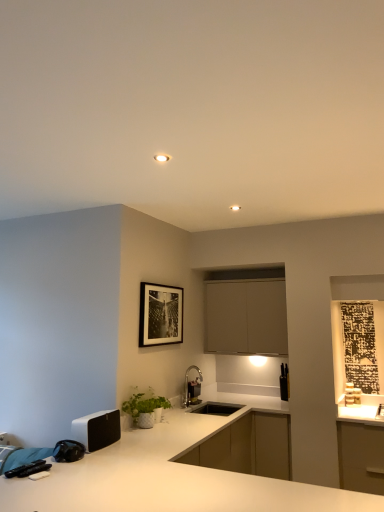
Question: From the image's perspective, is brushed metal faucet at lower center under white ceramic plant at lower center?

Choices:
 (A) no
 (B) yes

Answer: (B)

Question: From a real-world perspective, is brushed metal faucet at lower center under white ceramic plant at lower center?

Choices:
 (A) yes
 (B) no

Answer: (B)

Question: From the image's perspective, is brushed metal faucet at lower center over white ceramic plant at lower center?

Choices:
 (A) no
 (B) yes

Answer: (A)

Question: Considering the relative positions of brushed metal faucet at lower center and white ceramic plant at lower center in the image provided, is brushed metal faucet at lower center to the left of white ceramic plant at lower center from the viewer's perspective?

Choices:
 (A) yes
 (B) no

Answer: (B)

Question: Does brushed metal faucet at lower center have a lesser width compared to white ceramic plant at lower center?

Choices:
 (A) no
 (B) yes

Answer: (B)

Question: Can you confirm if brushed metal faucet at lower center is taller than white ceramic plant at lower center?

Choices:
 (A) yes
 (B) no

Answer: (A)

Question: From a real-world perspective, is black matte knife block at right, the 1th appliance in the right-to-left sequence, on white ceramic plant at lower center?

Choices:
 (A) yes
 (B) no

Answer: (A)

Question: Is black matte knife block at right, which appears as the third appliance when viewed from the front, oriented away from white ceramic plant at lower center?

Choices:
 (A) yes
 (B) no

Answer: (B)

Question: Does black matte knife block at right, the third appliance viewed from the left, have a larger size compared to white ceramic plant at lower center?

Choices:
 (A) no
 (B) yes

Answer: (A)

Question: Is black matte knife block at right, the 1th appliance in the right-to-left sequence, to the left of white ceramic plant at lower center from the viewer's perspective?

Choices:
 (A) yes
 (B) no

Answer: (B)

Question: Does black matte knife block at right, the third appliance viewed from the left, have a lesser width compared to white ceramic plant at lower center?

Choices:
 (A) no
 (B) yes

Answer: (B)

Question: Considering the relative sizes of black matte knife block at right, the 1th appliance in the right-to-left sequence, and white ceramic plant at lower center in the image provided, is black matte knife block at right, the 1th appliance in the right-to-left sequence, taller than white ceramic plant at lower center?

Choices:
 (A) yes
 (B) no

Answer: (A)

Question: Can you confirm if black matte picture frame at upper center is taller than white matte speaker at lower left, the 1th appliance positioned from the front?

Choices:
 (A) yes
 (B) no

Answer: (A)